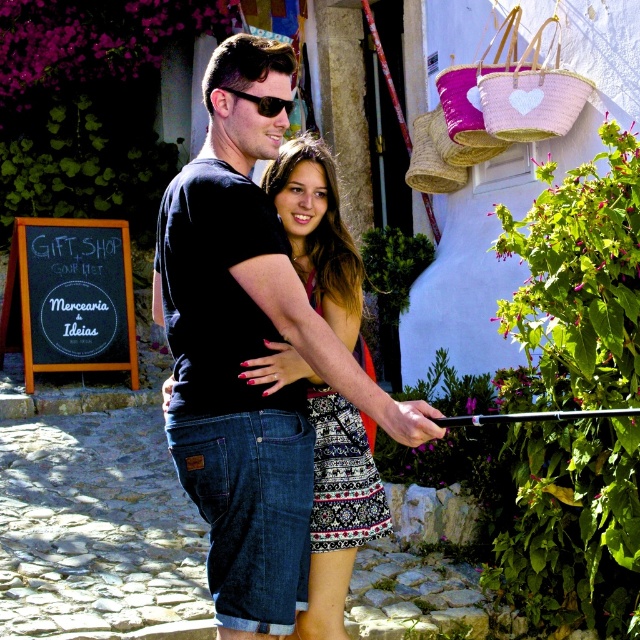
Is black chalkboard at left below black plastic sunglasses at upper center?

Indeed, black chalkboard at left is positioned under black plastic sunglasses at upper center.

Is black chalkboard at left to the left of black plastic sunglasses at upper center from the viewer's perspective?

Indeed, black chalkboard at left is positioned on the left side of black plastic sunglasses at upper center.

Which is in front, point (33, 282) or point (246, 97)?

Positioned in front is point (246, 97).

Locate an element on the screen. Image resolution: width=640 pixels, height=640 pixels. black chalkboard at left is located at coordinates (68, 298).

Can you confirm if black denim shorts at center is bigger than black plastic sunglasses at upper center?

Yes.

Who is lower down, black denim shorts at center or black plastic sunglasses at upper center?

black denim shorts at center is below.

Image resolution: width=640 pixels, height=640 pixels. Find the location of `black denim shorts at center`. black denim shorts at center is located at coordinates (248, 353).

Who is more distant from viewer, (364, 486) or (228, 92)?

The point (364, 486) is more distant.

This screenshot has height=640, width=640. Describe the element at coordinates (342, 474) in the screenshot. I see `black printed fabric dress at center` at that location.

The height and width of the screenshot is (640, 640). What are the coordinates of `black printed fabric dress at center` in the screenshot? It's located at (342, 474).